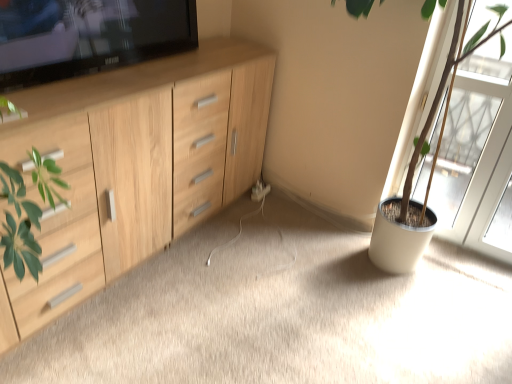
Question: Would you say green matte plant pot at right is a long distance from white plastic electric outlet at center?

Choices:
 (A) yes
 (B) no

Answer: (B)

Question: Is green matte plant pot at right surrounding white plastic electric outlet at center?

Choices:
 (A) yes
 (B) no

Answer: (B)

Question: Can you confirm if green matte plant pot at right is bigger than white plastic electric outlet at center?

Choices:
 (A) yes
 (B) no

Answer: (A)

Question: Is green matte plant pot at right wider than white plastic electric outlet at center?

Choices:
 (A) no
 (B) yes

Answer: (B)

Question: Does green matte plant pot at right have a lesser height compared to white plastic electric outlet at center?

Choices:
 (A) yes
 (B) no

Answer: (B)

Question: Do you think white plastic electric outlet at center is within light wood cabinet at left, or outside of it?

Choices:
 (A) inside
 (B) outside

Answer: (A)

Question: Is point (252, 196) closer or farther from the camera than point (18, 140)?

Choices:
 (A) farther
 (B) closer

Answer: (A)

Question: From the image's perspective, is white plastic electric outlet at center above or below light wood cabinet at left?

Choices:
 (A) below
 (B) above

Answer: (A)

Question: In terms of height, does white plastic electric outlet at center look taller or shorter compared to light wood cabinet at left?

Choices:
 (A) tall
 (B) short

Answer: (B)

Question: Considering the positions of wooden cabinet at left and transparent glass screen door at right in the image, is wooden cabinet at left bigger or smaller than transparent glass screen door at right?

Choices:
 (A) small
 (B) big

Answer: (B)

Question: Is wooden cabinet at left inside or outside of transparent glass screen door at right?

Choices:
 (A) outside
 (B) inside

Answer: (A)

Question: Is wooden cabinet at left taller or shorter than transparent glass screen door at right?

Choices:
 (A) tall
 (B) short

Answer: (B)

Question: From the image's perspective, is wooden cabinet at left located above or below transparent glass screen door at right?

Choices:
 (A) above
 (B) below

Answer: (B)

Question: Does point (262, 196) appear closer or farther from the camera than point (290, 236)?

Choices:
 (A) farther
 (B) closer

Answer: (A)

Question: Relative to wooden cabinet at left, is white plastic electric outlet at center in front or behind?

Choices:
 (A) behind
 (B) front

Answer: (A)